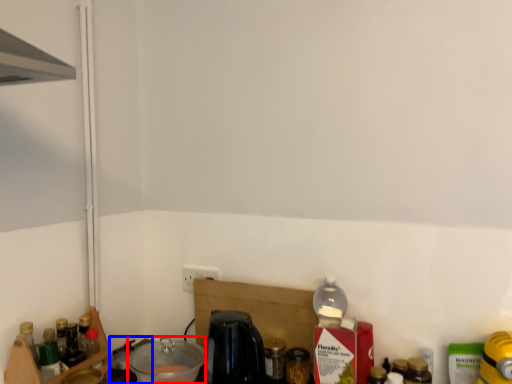
Question: Which object appears closest to the camera in this image, appliance (highlighted by a red box) or appliance (highlighted by a blue box)?

Choices:
 (A) appliance
 (B) appliance

Answer: (A)